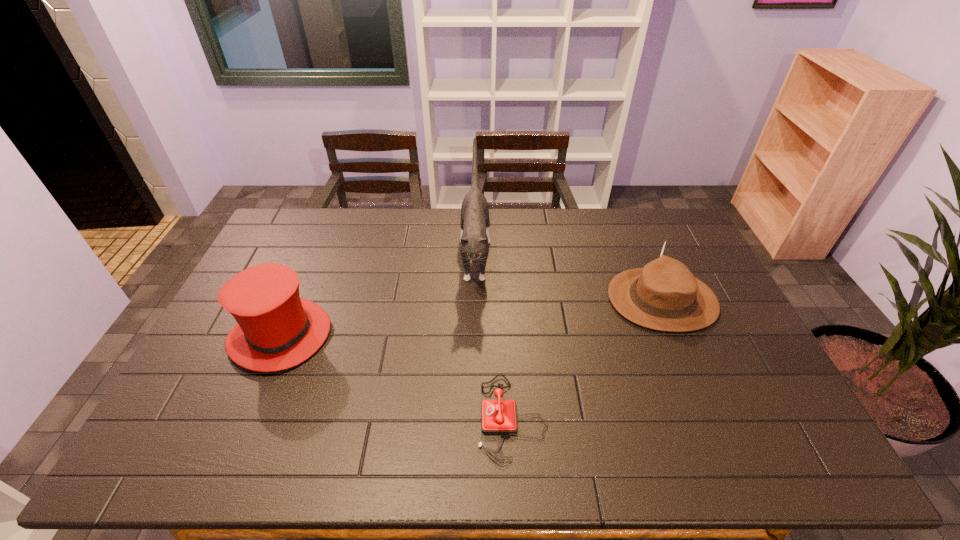
Find the location of a particular element. This screenshot has height=540, width=960. vacant region located on the feather side of the second shortest object is located at coordinates (583, 300).

The image size is (960, 540). In order to click on vacant space located on the dial of the telephone in this screenshot , I will do `click(352, 417)`.

At what (x,y) coordinates should I click in order to perform the action: click on vacant area situated on the dial of the telephone. Please return your answer as a coordinate pair (x, y). The width and height of the screenshot is (960, 540). Looking at the image, I should click on (352, 417).

The width and height of the screenshot is (960, 540). In order to click on free space located 0.200m on the dial of the telephone in this screenshot , I will do `click(396, 417)`.

The height and width of the screenshot is (540, 960). I want to click on object that is at the far edge, so click(x=475, y=224).

Where is `object at the near edge`? This screenshot has width=960, height=540. object at the near edge is located at coordinates (499, 416).

At what (x,y) coordinates should I click in order to perform the action: click on object present at the left edge. Please return your answer as a coordinate pair (x, y). The height and width of the screenshot is (540, 960). Looking at the image, I should click on (276, 329).

Locate an element on the screen. Image resolution: width=960 pixels, height=540 pixels. object that is at the right edge is located at coordinates (664, 295).

Image resolution: width=960 pixels, height=540 pixels. I want to click on vacant region at the far edge, so [x=491, y=220].

Image resolution: width=960 pixels, height=540 pixels. I want to click on blank space at the near edge of the desktop, so click(737, 457).